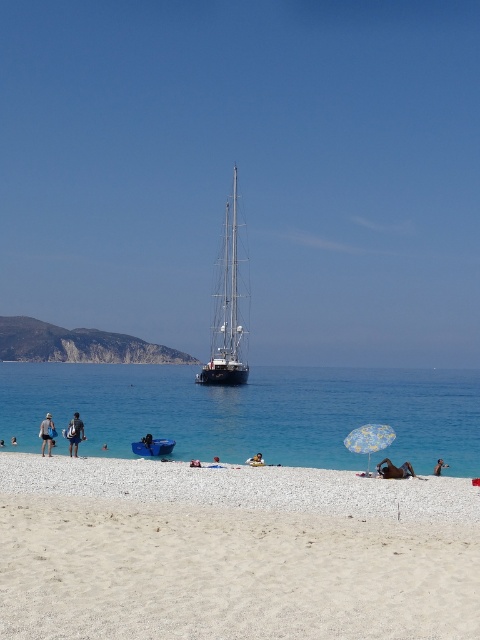
Based on the photo, you are standing on the beach and see the dark blue jeans at lower left and the dark blue fabric umbrella at center. Which object is taller?

The dark blue jeans at lower left is taller than the dark blue fabric umbrella at center.

You are a photographer planning to take a photo of the white sand at lower center and the tan skin person at center. Based on their sizes, which object should you focus on first if you want both to be in sharp focus?

The white sand at lower center is larger than the tan skin person at center, so focusing on the white sand at lower center first would ensure both are in sharp focus since it is closer to the camera.